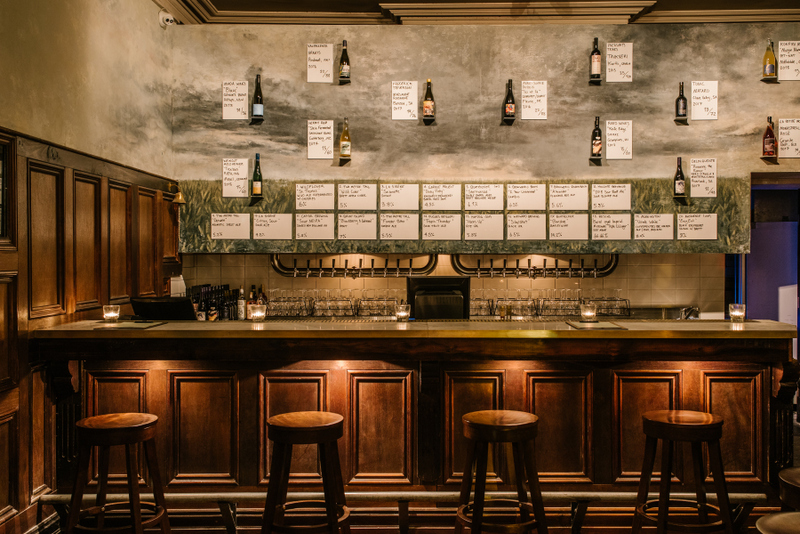
Where is `bar stools`? bar stools is located at coordinates (106, 423), (292, 435), (484, 431), (670, 435), (784, 514), (794, 475).